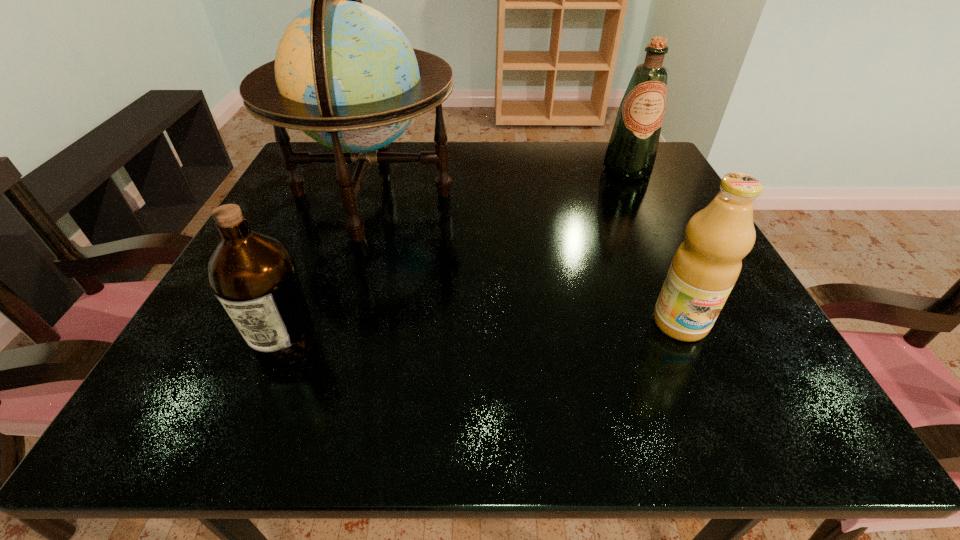
Where is `vacant space that's between the leftmost olive oil and the farthest olive oil`? This screenshot has width=960, height=540. vacant space that's between the leftmost olive oil and the farthest olive oil is located at coordinates (457, 256).

At what (x,y) coordinates should I click in order to perform the action: click on blank region between the tallest object and the farthest olive oil. Please return your answer as a coordinate pair (x, y). This screenshot has width=960, height=540. Looking at the image, I should click on (500, 181).

In order to click on vacant space that is in between the tallest object and the leftmost olive oil in this screenshot , I will do `click(329, 268)`.

Locate an element on the screen. The width and height of the screenshot is (960, 540). free area in between the tallest object and the leftmost olive oil is located at coordinates (329, 268).

Locate an element on the screen. free space between the leftmost olive oil and the tallest object is located at coordinates (329, 268).

Locate an element on the screen. object that is the second closest one to the leftmost olive oil is located at coordinates (706, 266).

Select which object is the second closest to the leftmost olive oil. Please provide its 2D coordinates. Your answer should be formatted as a tuple, i.e. [(x, y)], where the tuple contains the x and y coordinates of a point satisfying the conditions above.

[(706, 266)]

The height and width of the screenshot is (540, 960). In order to click on the second closest olive oil to the leftmost olive oil in this screenshot , I will do `click(632, 149)`.

Find the location of a particular element. olive oil that stands as the closest to the globe is located at coordinates (254, 276).

This screenshot has width=960, height=540. What are the coordinates of `vacant space that satisfies the following two spatial constraints: 1. on the surface of the tallest object; 2. on the label of the leftmost olive oil` in the screenshot? It's located at (324, 343).